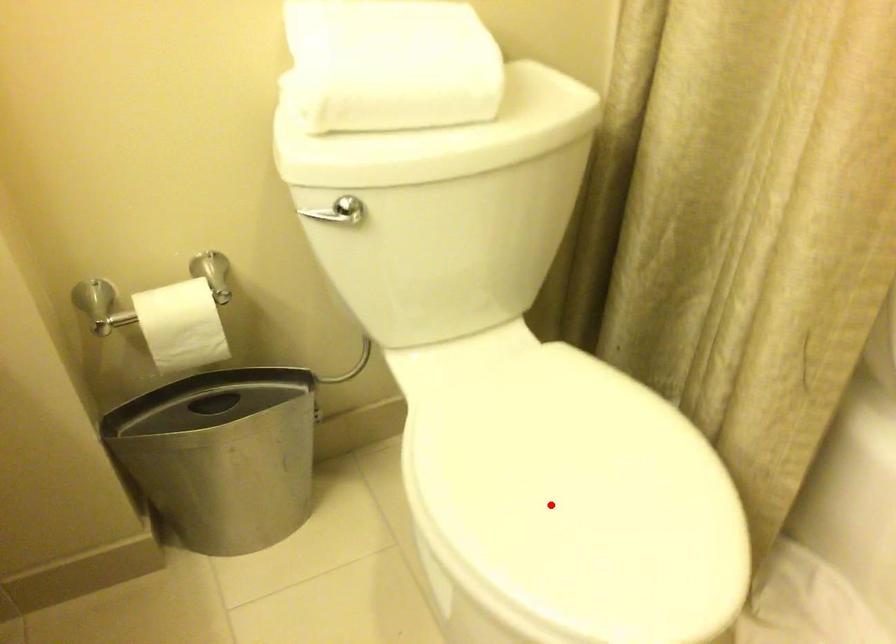
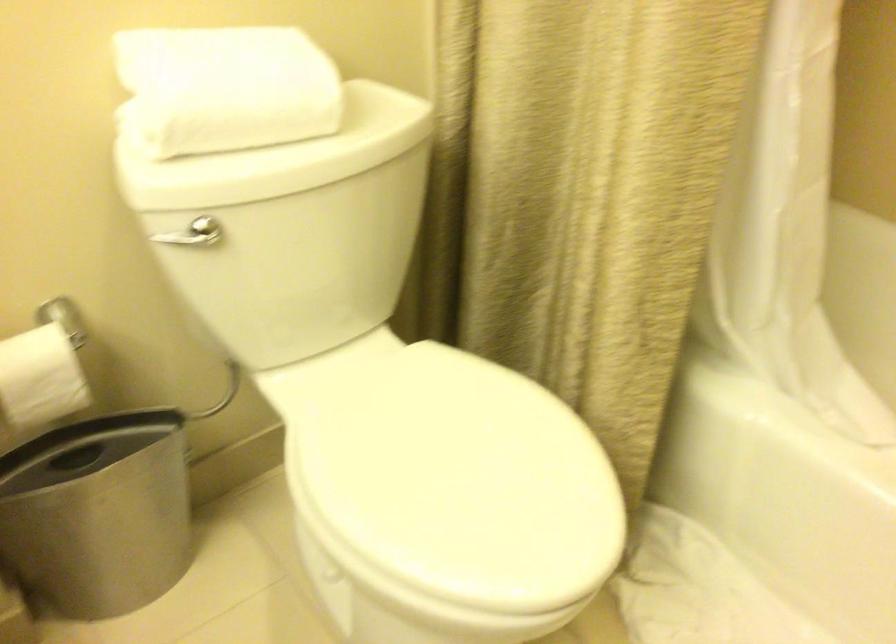
In the second image, find the point that corresponds to the highlighted location in the first image.

(442, 485)